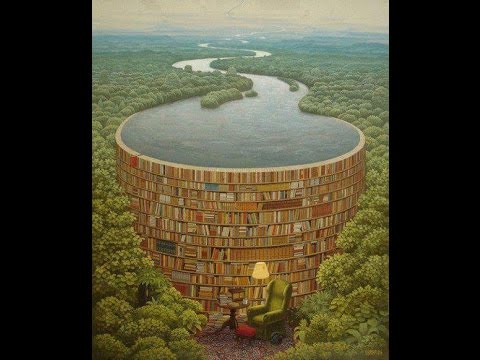
In order to click on lamp in this screenshot , I will do (259, 278).